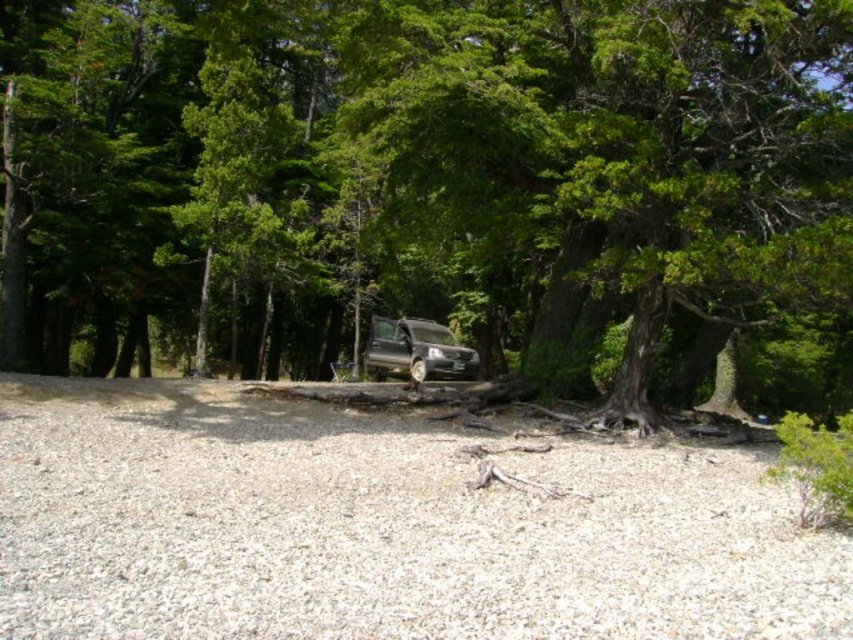
You are standing at the edge of the clearing in the forest. You see a point marked at coordinates (430, 184). What object does this point correspond to?

The point at coordinates (430, 184) corresponds to the green leafy tree at center.

From the picture: You are a hiker who needs to take a photo of the metallic silver van at center from above. Can you stand on the green leafy tree at center to reach a higher vantage point?

The green leafy tree at center is taller than the metallic silver van at center, so yes, you can stand on the green leafy tree at center to get a higher vantage point for the photo.